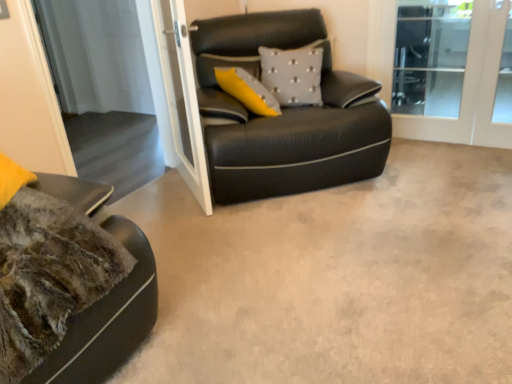
Identify the location of free space to the left of white glass screen door at upper center, which is the second screen door from left to right. Image resolution: width=512 pixels, height=384 pixels. (156, 193).